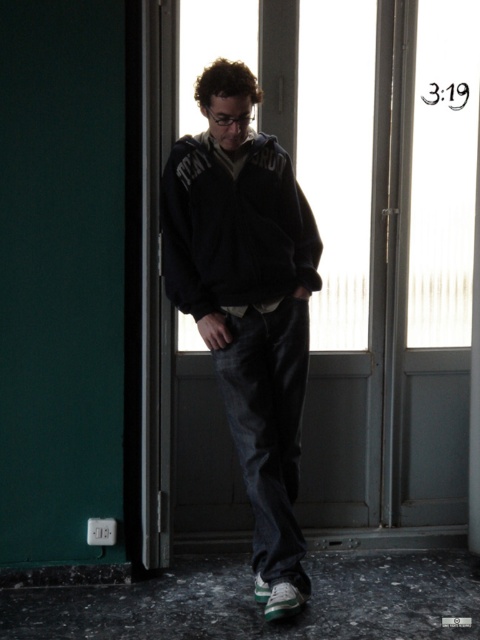
You are a photographer adjusting your camera settings. You notice two points in the scene at coordinates point (282,35) and point (286,420). Which point is closer to your camera lens?

Point (282,35) is further to the camera than point (286,420), so the point closer to the camera lens is point (286,420).

You are a delivery person who needs to carry a large package through the transparent glass door at center and the dark blue fleece jacket at center. Which object will you have to maneuver around because it is smaller?

The dark blue fleece jacket at center is smaller than the transparent glass door at center, so you will have to maneuver around the dark blue fleece jacket at center to carry the large package through the transparent glass door at center.

You are a delivery person who needs to hand over a package to the recipient standing in the room. The recipient is wearing the dark blue fleece jacket at center and is near the transparent glass door at center. To ensure you approach them correctly, which object should you walk towards first?

You should walk towards the transparent glass door at center first because it is positioned on the right side of the dark blue fleece jacket at center, so approaching the door first will lead you closer to the recipient wearing the jacket.